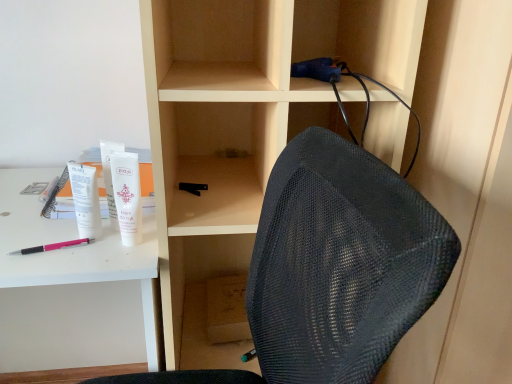
The width and height of the screenshot is (512, 384). Find the location of `vacant area in front of white matte tube at upper left, which is the second stationery in left-to-right order`. vacant area in front of white matte tube at upper left, which is the second stationery in left-to-right order is located at coordinates (89, 256).